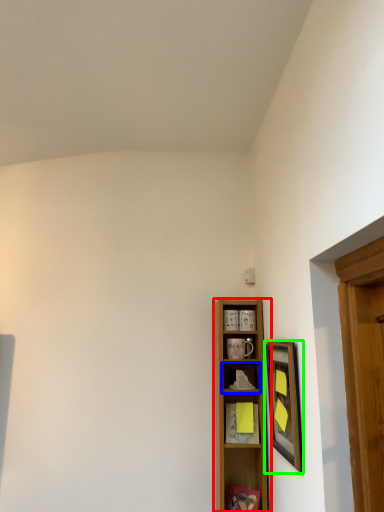
Question: Which is nearer to the shelf (highlighted by a red box)? shelf (highlighted by a blue box) or picture frame (highlighted by a green box).

Choices:
 (A) shelf
 (B) picture frame

Answer: (A)